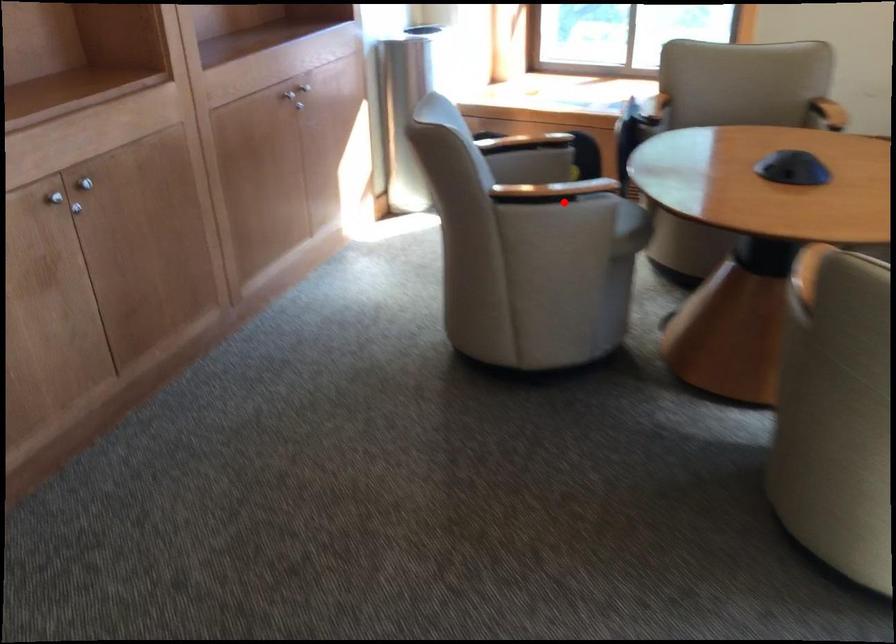
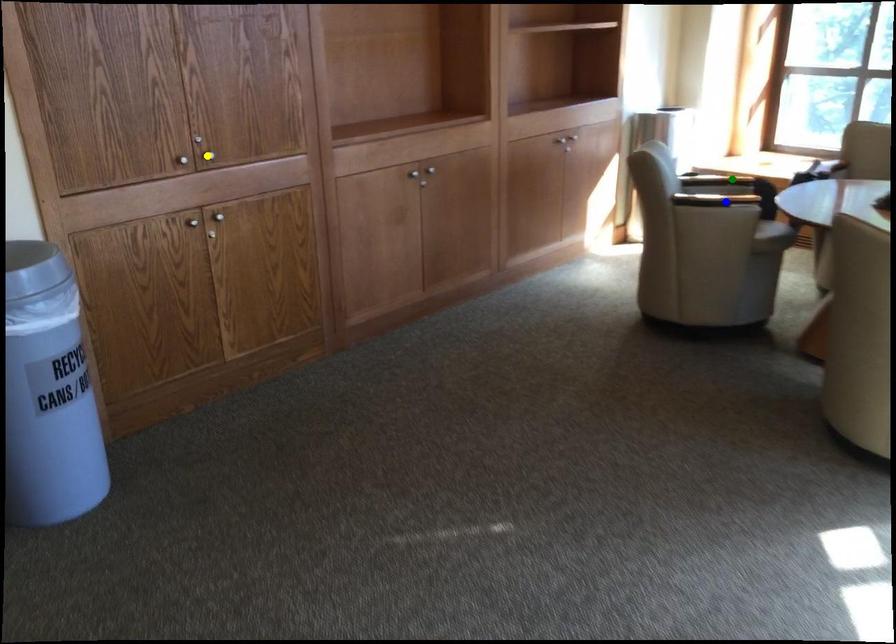
Question: I am providing you with two images of the same scene from different viewpoints. A red point is marked on the first image. You are given multiple points on the second image. Can you choose the point in image 2 that corresponds to the point in image 1?

Choices:
 (A) green point
 (B) yellow point
 (C) blue point

Answer: (C)